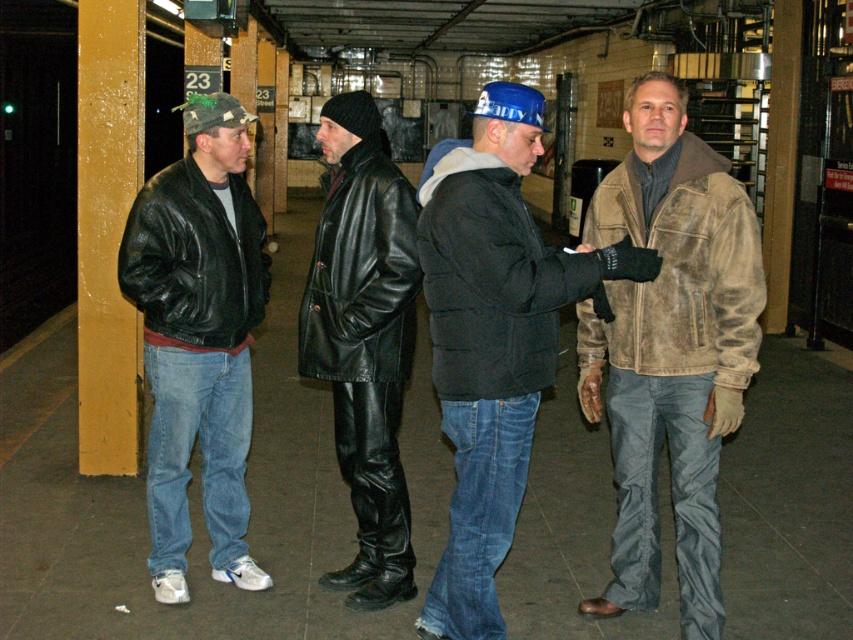
Does leather jacket at center have a smaller size compared to black leather jacket at center?

Actually, leather jacket at center might be larger than black leather jacket at center.

Which is more to the right, leather jacket at center or black leather jacket at center?

leather jacket at center

Does point (697, 438) lie behind point (331, 291)?

No, (697, 438) is in front of (331, 291).

Where is `leather jacket at center`? leather jacket at center is located at coordinates (670, 349).

Is dark brown leather jacket at center smaller than black puffy jacket at center?

Actually, dark brown leather jacket at center might be larger than black puffy jacket at center.

Does dark brown leather jacket at center lie behind black puffy jacket at center?

That is True.

Image resolution: width=853 pixels, height=640 pixels. Find the location of `dark brown leather jacket at center`. dark brown leather jacket at center is located at coordinates (492, 340).

Who is taller, leather jacket at center or brown suede jacket at right?

Standing taller between the two is leather jacket at center.

Does leather jacket at center appear under brown suede jacket at right?

Yes, leather jacket at center is below brown suede jacket at right.

You are a GUI agent. You are given a task and a screenshot of the screen. Output one action in this format:
    pyautogui.click(x=<x>, y=<y>)
    Task: Click on the leather jacket at center
    Image resolution: width=853 pixels, height=640 pixels.
    Given the screenshot: What is the action you would take?
    pyautogui.click(x=670, y=349)

You are a GUI agent. You are given a task and a screenshot of the screen. Output one action in this format:
    pyautogui.click(x=<x>, y=<y>)
    Task: Click on the leather jacket at center
    The height and width of the screenshot is (640, 853).
    Given the screenshot: What is the action you would take?
    pyautogui.click(x=670, y=349)